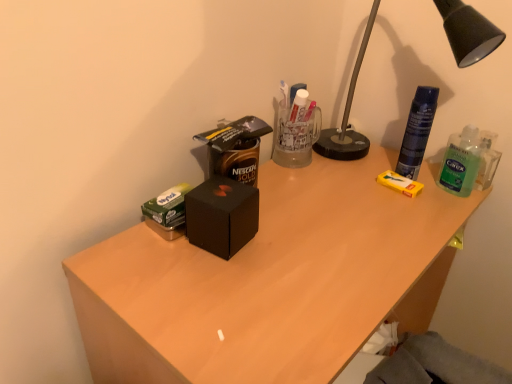
This screenshot has height=384, width=512. I want to click on vacant space that is in between green translucent hand sanitizer at right and black matte box at center, so click(x=347, y=214).